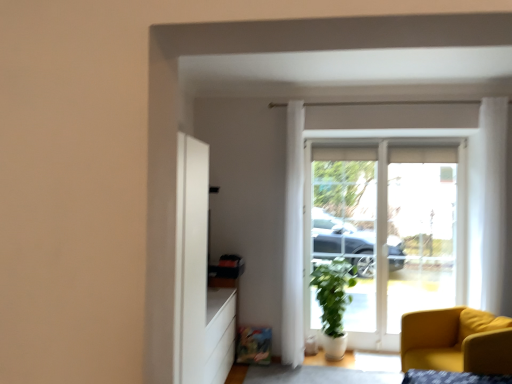
Question: Is white sheer curtain at upper right, the first curtain positioned from the right, inside the boundaries of white glass door at center, or outside?

Choices:
 (A) inside
 (B) outside

Answer: (B)

Question: In the image, is white sheer curtain at upper right, the first curtain positioned from the right, positioned in front of or behind white glass door at center?

Choices:
 (A) behind
 (B) front

Answer: (B)

Question: Which of these objects is positioned closest to the white sheer curtain at upper right, the second curtain from the back?

Choices:
 (A) white glass door at center
 (B) matte yellow armchair at lower right
 (C) green matte plant at center
 (D) white sheer curtain at center, arranged as the first curtain when viewed from the left

Answer: (B)

Question: Estimate the real-world distances between objects in this image. Which object is closer to the white sheer curtain at upper right, which is the second curtain in left-to-right order?

Choices:
 (A) green matte plant at center
 (B) white glass door at center
 (C) matte yellow armchair at lower right
 (D) white sheer curtain at center, arranged as the first curtain when viewed from the left

Answer: (C)